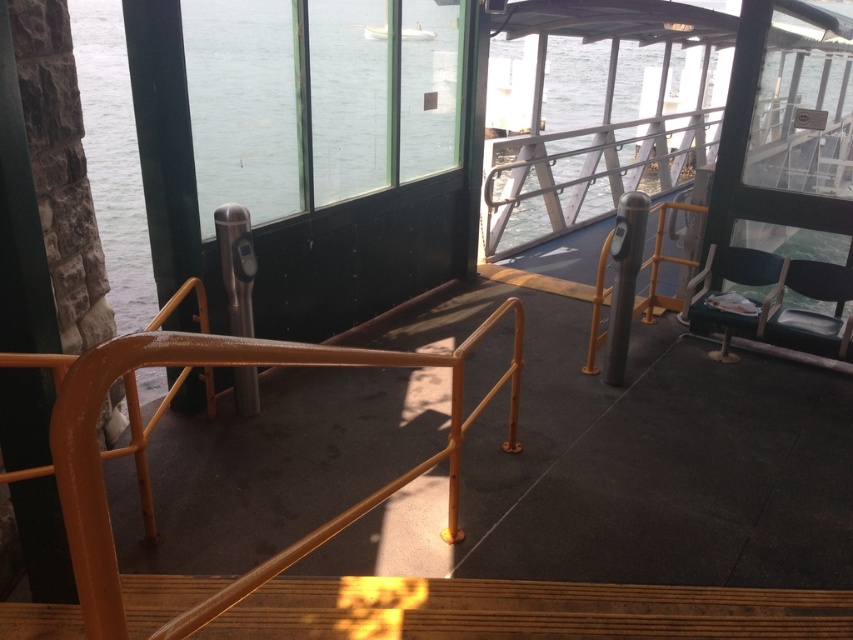
Question: Which of the following is the closest to the observer?

Choices:
 (A) orange painted metal handrail at center
 (B) black leather chair at right
 (C) white glossy boat at upper center

Answer: (A)

Question: From the image, what is the correct spatial relationship of orange painted metal handrail at center in relation to black leather chair at right?

Choices:
 (A) above
 (B) below

Answer: (B)

Question: Among these points, which one is farthest from the camera?

Choices:
 (A) (849, 356)
 (B) (84, 396)
 (C) (415, 33)

Answer: (C)

Question: Can you confirm if orange painted metal handrail at center is bigger than green fabric chair at right?

Choices:
 (A) no
 (B) yes

Answer: (B)

Question: Can you confirm if green fabric chair at right is positioned to the left of white glossy boat at upper center?

Choices:
 (A) yes
 (B) no

Answer: (B)

Question: Which object is positioned closest to the white glossy boat at upper center?

Choices:
 (A) black leather chair at right
 (B) green fabric chair at right

Answer: (B)